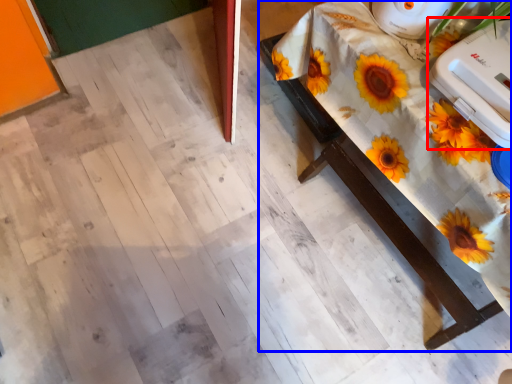
Question: Which object appears farthest to the camera in this image, appliance (highlighted by a red box) or table (highlighted by a blue box)?

Choices:
 (A) appliance
 (B) table

Answer: (A)